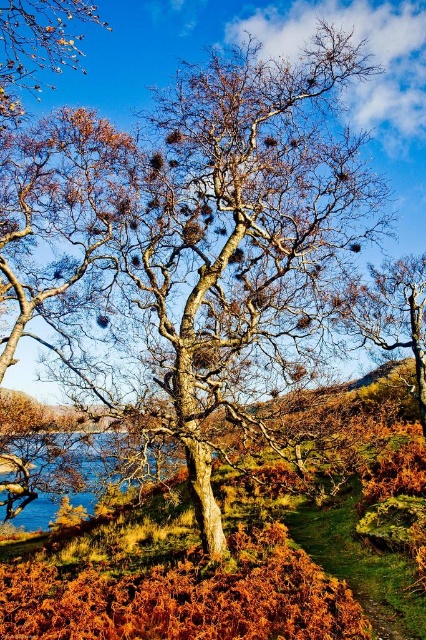
Question: From the image, what is the correct spatial relationship of smooth brown tree at upper left in relation to smooth bark tree at center?

Choices:
 (A) above
 (B) below

Answer: (A)

Question: Among these points, which one is farthest from the camera?

Choices:
 (A) (400, 284)
 (B) (26, 26)

Answer: (A)

Question: Which point is closer to the camera?

Choices:
 (A) (371, 282)
 (B) (69, 26)

Answer: (B)

Question: Can you confirm if smooth brown tree at upper left is positioned above smooth bark tree at center?

Choices:
 (A) yes
 (B) no

Answer: (A)

Question: In this image, where is smooth brown tree at upper left located relative to smooth bark tree at center?

Choices:
 (A) left
 (B) right

Answer: (A)